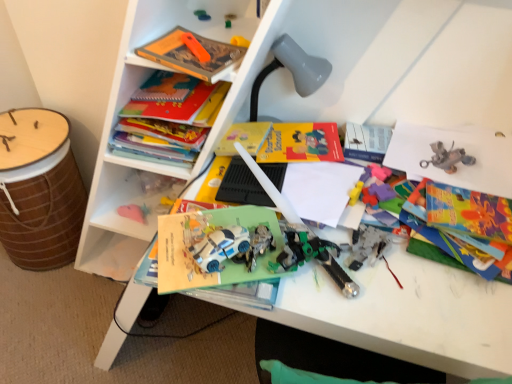
The width and height of the screenshot is (512, 384). What do you see at coordinates (292, 70) in the screenshot?
I see `gray matte lamp at upper center` at bounding box center [292, 70].

Describe the element at coordinates (383, 196) in the screenshot. This screenshot has height=384, width=512. I see `rubberized plastic puzzle pieces at center, which ranks as the fourth toy in top-to-bottom order` at that location.

In order to face hardcover book at upper left, which is the 1th book from back to front, should I rotate leftwards or rightwards?

It's best to rotate left around 9.556 degrees.

This screenshot has width=512, height=384. What do you see at coordinates (220, 247) in the screenshot? I see `white plastic toy car at center` at bounding box center [220, 247].

The width and height of the screenshot is (512, 384). Describe the element at coordinates (193, 54) in the screenshot. I see `matte orange book at upper center, positioned as the second book in back-to-front order` at that location.

The height and width of the screenshot is (384, 512). I want to click on gray matte lamp at upper center, so pos(292,70).

Between matte plastic toy at upper center, acting as the 4th toy starting from the right, and matte orange book at upper center, which is the first book in front-to-back order, which one is positioned in front?

Positioned in front is matte orange book at upper center, which is the first book in front-to-back order.

Considering the sizes of matte plastic toy at upper center, acting as the 4th toy starting from the right, and matte orange book at upper center, which is the first book in front-to-back order, in the image, is matte plastic toy at upper center, acting as the 4th toy starting from the right, bigger or smaller than matte orange book at upper center, which is the first book in front-to-back order,?

In the image, matte plastic toy at upper center, acting as the 4th toy starting from the right, appears to be smaller than matte orange book at upper center, which is the first book in front-to-back order.

Is hardcover book at upper left, which is the 1th book from back to front, closer to the viewer compared to green plastic toy at center, which appears as the second toy when viewed from the right?

Yes, hardcover book at upper left, which is the 1th book from back to front, is closer to the viewer.

From a real-world perspective, which is physically above, hardcover book at upper left, which appears as the 2th book when viewed from the front, or green plastic toy at center, which appears as the second toy when viewed from the right?

green plastic toy at center, which appears as the second toy when viewed from the right, is physically above.

Does point (155, 160) come behind point (226, 14)?

That is True.

Which is more to the right, hardcover book at upper left, which is the 1th book from back to front, or green plastic toy at center, marked as the 3th toy in a bottom-to-top arrangement?

Positioned to the right is green plastic toy at center, marked as the 3th toy in a bottom-to-top arrangement.

Who is bigger, gray matte lamp at upper center or white plastic toy car at center?

With larger size is gray matte lamp at upper center.

Which object is further away from the camera taking this photo, gray matte lamp at upper center or white plastic toy car at center?

gray matte lamp at upper center is further away from the camera.

Is gray matte lamp at upper center taller or shorter than white plastic toy car at center?

Considering their sizes, gray matte lamp at upper center has more height than white plastic toy car at center.

From the image's perspective, between gray matte lamp at upper center and white plastic toy car at center, who is located below?

white plastic toy car at center appears lower in the image.

How different are the orientations of brown woven drum at left and green plastic toy at center, which appears as the second toy when viewed from the right, in degrees?

8.12 degrees.

Which of these two, brown woven drum at left or green plastic toy at center, which appears as the second toy when viewed from the right, is smaller?

Smaller between the two is green plastic toy at center, which appears as the second toy when viewed from the right.

From the image's perspective, is brown woven drum at left above or below green plastic toy at center, the third toy in the left-to-right sequence?

Clearly, from the image's perspective, brown woven drum at left is below green plastic toy at center, the third toy in the left-to-right sequence.

This screenshot has height=384, width=512. What are the coordinates of `drum on the left of green plastic toy at center, the third toy in the left-to-right sequence` in the screenshot? It's located at (39, 189).

From the image's perspective, which book is the 1st one above the brown woven drum at left? Please provide its 2D coordinates.

[(169, 127)]

From a real-world perspective, does hardcover book at upper left, which appears as the 2th book when viewed from the front, stand above brown woven drum at left?

Yes, from a real-world perspective, hardcover book at upper left, which appears as the 2th book when viewed from the front, is above brown woven drum at left.

Does hardcover book at upper left, which is the 1th book from back to front, come in front of brown woven drum at left?

That is True.

Considering the sizes of hardcover book at upper left, which is the 1th book from back to front, and white plastic toy car at center in the image, is hardcover book at upper left, which is the 1th book from back to front, bigger or smaller than white plastic toy car at center?

hardcover book at upper left, which is the 1th book from back to front, is bigger than white plastic toy car at center.

Is hardcover book at upper left, which is the 1th book from back to front, in front of or behind white plastic toy car at center in the image?

In the image, hardcover book at upper left, which is the 1th book from back to front, appears behind white plastic toy car at center.

From the image's perspective, which is above, hardcover book at upper left, which is the 1th book from back to front, or white plastic toy car at center?

hardcover book at upper left, which is the 1th book from back to front.

Which point is more forward, (114, 135) or (207, 271)?

The point (207, 271) is closer.

Is orange plastic toy at upper center, placed as the 3th toy when sorted from right to left, next to brown woven drum at left?

orange plastic toy at upper center, placed as the 3th toy when sorted from right to left, and brown woven drum at left are not in contact.

From the image's perspective, which is above, orange plastic toy at upper center, positioned as the 2th toy in left-to-right order, or brown woven drum at left?

orange plastic toy at upper center, positioned as the 2th toy in left-to-right order.

Considering the relative positions of orange plastic toy at upper center, which ranks as the third toy in top-to-bottom order, and brown woven drum at left in the image provided, is orange plastic toy at upper center, which ranks as the third toy in top-to-bottom order, to the right of brown woven drum at left from the viewer's perspective?

Indeed, orange plastic toy at upper center, which ranks as the third toy in top-to-bottom order, is positioned on the right side of brown woven drum at left.

Which is less distant, (192, 44) or (12, 156)?

Point (192, 44).

Where is `the 1st book to the left of the matte plastic toy at upper center, acting as the 4th toy starting from the right, starting your count from the anchor`? This screenshot has width=512, height=384. the 1st book to the left of the matte plastic toy at upper center, acting as the 4th toy starting from the right, starting your count from the anchor is located at coordinates click(x=193, y=54).

What are the coordinates of `the 2nd toy behind the hardcover book at upper left, which is the 1th book from back to front, starting your count from the anchor` in the screenshot? It's located at (229, 20).

Considering their positions, is brown woven drum at left positioned closer to hardcover book at upper left, which appears as the 2th book when viewed from the front, than rubberized plastic puzzle pieces at center, which ranks as the first toy in right-to-left order?

The object closer to hardcover book at upper left, which appears as the 2th book when viewed from the front, is rubberized plastic puzzle pieces at center, which ranks as the first toy in right-to-left order.

When comparing their distances from matte orange book at upper center, positioned as the second book in back-to-front order, does orange plastic toy at upper center, which ranks as the third toy in top-to-bottom order, or hardcover book at upper left, which is the 1th book from back to front, seem closer?

orange plastic toy at upper center, which ranks as the third toy in top-to-bottom order, is positioned closer to the anchor matte orange book at upper center, positioned as the second book in back-to-front order.

Based on their spatial positions, is green plastic toy at center, which appears as the second toy when viewed from the right, or rubberized plastic puzzle pieces at center, which ranks as the first toy in right-to-left order, further from brown woven drum at left?

Among the two, rubberized plastic puzzle pieces at center, which ranks as the first toy in right-to-left order, is located further to brown woven drum at left.

Estimate the real-world distances between objects in this image. Which object is further from matte orange book at upper center, which is the first book in front-to-back order, rubberized plastic puzzle pieces at center, the 4th toy when ordered from left to right, or green plastic toy at center, marked as the 3th toy in a bottom-to-top arrangement?

The object further to matte orange book at upper center, which is the first book in front-to-back order, is rubberized plastic puzzle pieces at center, the 4th toy when ordered from left to right.

Considering their positions, is hardcover book at upper left, which appears as the 2th book when viewed from the front, positioned closer to rubberized plastic puzzle pieces at center, which ranks as the first toy in right-to-left order, than brown woven drum at left?

hardcover book at upper left, which appears as the 2th book when viewed from the front.

When comparing their distances from gray matte lamp at upper center, does rubberized plastic puzzle pieces at center, which ranks as the first toy in right-to-left order, or green plastic toy at center, which appears as the second toy when viewed from the right, seem further?

rubberized plastic puzzle pieces at center, which ranks as the first toy in right-to-left order, is positioned further to the anchor gray matte lamp at upper center.

Based on their spatial positions, is matte orange book at upper center, positioned as the second book in back-to-front order, or white plastic toy car at center further from green plastic toy at center, the third toy in the left-to-right sequence?

The object further to green plastic toy at center, the third toy in the left-to-right sequence, is white plastic toy car at center.

Estimate the real-world distances between objects in this image. Which object is further from white plastic toy car at center, brown woven drum at left or matte plastic toy at upper center, arranged as the 4th toy when ordered from the bottom?

Among the two, brown woven drum at left is located further to white plastic toy car at center.

Identify the location of book between matte orange book at upper center, positioned as the second book in back-to-front order, and white plastic toy car at center vertically. (169, 127).

In order to click on toy between gray matte lamp at upper center and white plastic toy car at center in the vertical direction in this screenshot , I will do `click(383, 196)`.

At what (x,y) coordinates should I click in order to perform the action: click on book located between hardcover book at upper left, which appears as the 2th book when viewed from the front, and rubberized plastic puzzle pieces at center, which ranks as the first toy in right-to-left order, in the left-right direction. Please return your answer as a coordinate pair (x, y). The height and width of the screenshot is (384, 512). Looking at the image, I should click on (193, 54).

Find the location of a particular element. This screenshot has width=512, height=384. book that lies between gray matte lamp at upper center and white plastic toy car at center from top to bottom is located at coordinates (169, 127).